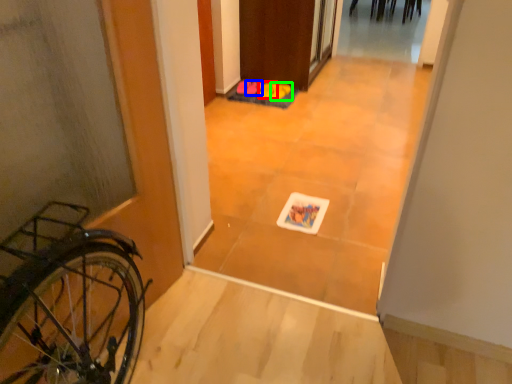
Question: Estimate the real-world distances between objects in this image. Which object is farther from footwear (highlighted by a red box), footwear (highlighted by a blue box) or footwear (highlighted by a green box)?

Choices:
 (A) footwear
 (B) footwear

Answer: (A)